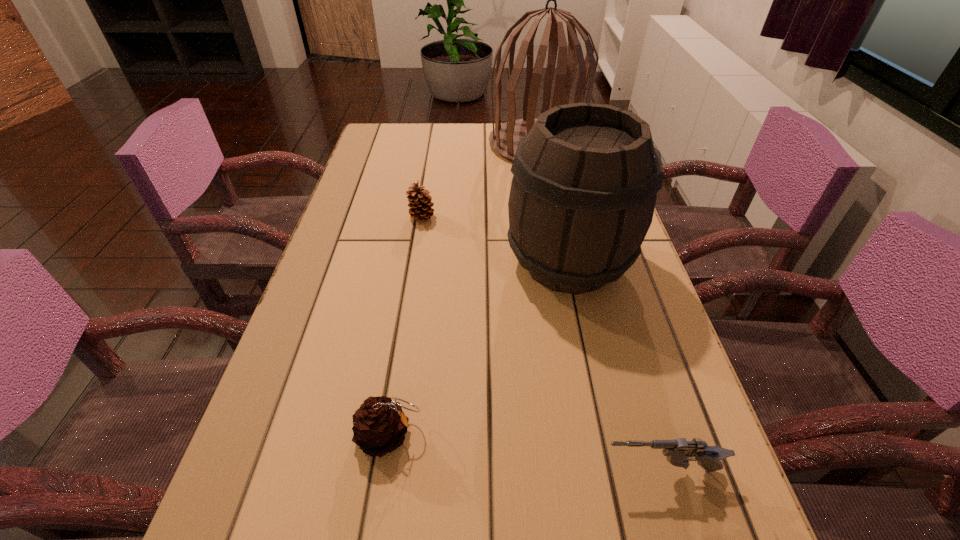
The image size is (960, 540). What are the coordinates of `free location at the right edge of the desktop` in the screenshot? It's located at (666, 325).

Locate an element on the screen. free space between the nearer pinecone and the tallest object is located at coordinates (463, 289).

At what (x,y) coordinates should I click in order to perform the action: click on empty location between the farther pinecone and the second tallest object. Please return your answer as a coordinate pair (x, y). Looking at the image, I should click on (495, 240).

Find the location of a particular element. The height and width of the screenshot is (540, 960). vacant space in between the farther pinecone and the fourth farthest object is located at coordinates (406, 326).

Identify the location of empty location between the nearest object and the tallest object. Image resolution: width=960 pixels, height=540 pixels. [598, 307].

The image size is (960, 540). I want to click on empty location between the farther pinecone and the nearest object, so click(540, 344).

Find the location of a particular element. This screenshot has width=960, height=540. empty space that is in between the nearer pinecone and the second tallest object is located at coordinates coord(479,349).

Where is `empty space that is in between the nearest object and the tallest object`? The height and width of the screenshot is (540, 960). empty space that is in between the nearest object and the tallest object is located at coordinates (598, 307).

You are a GUI agent. You are given a task and a screenshot of the screen. Output one action in this format:
    pyautogui.click(x=<x>, y=<y>)
    Task: Click on the vacant space that's between the nearer pinecone and the tallest object
    
    Given the screenshot: What is the action you would take?
    pyautogui.click(x=463, y=289)

In order to click on free space that is in between the wine bucket and the second nearest object in this screenshot , I will do point(479,349).